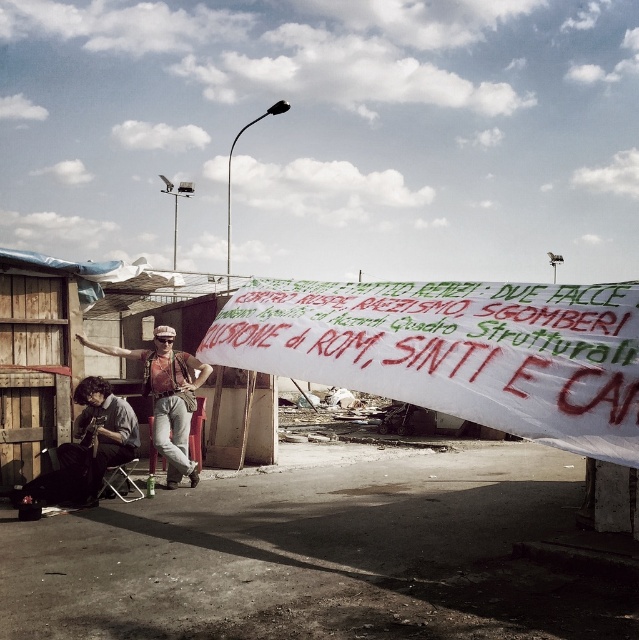
You are a photographer trying to capture a clear shot of the white paper banner at center without any obstructions. The denim jacket at lower left is blocking part of the banner. How can you adjust your position to ensure the banner is fully visible?

Move your camera position so that the denim jacket at lower left is no longer in front of the white paper banner at center. Since the white paper banner at center is in front of the denim jacket at lower left, adjusting your angle or moving around the denim jacket at lower left will allow the banner to be fully visible without obstruction.